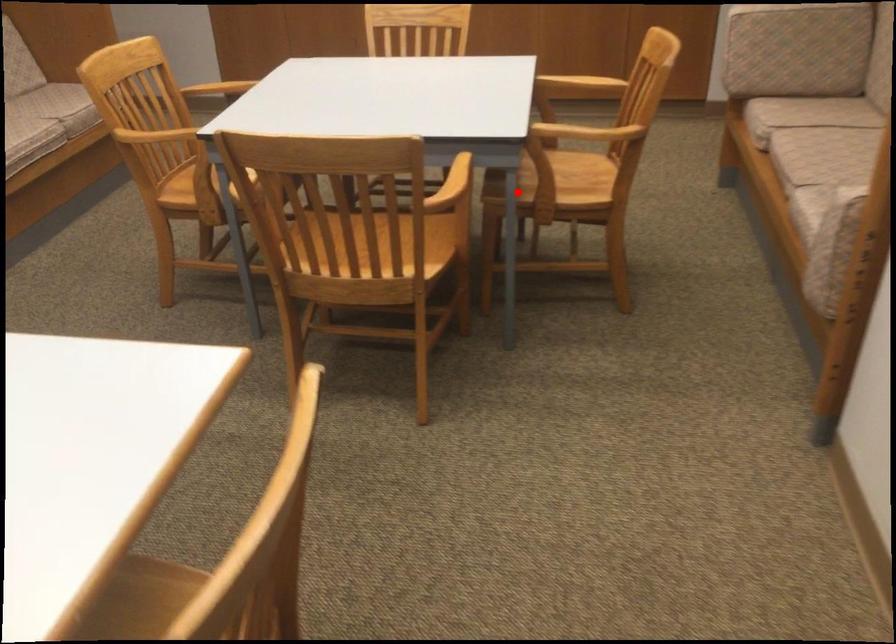
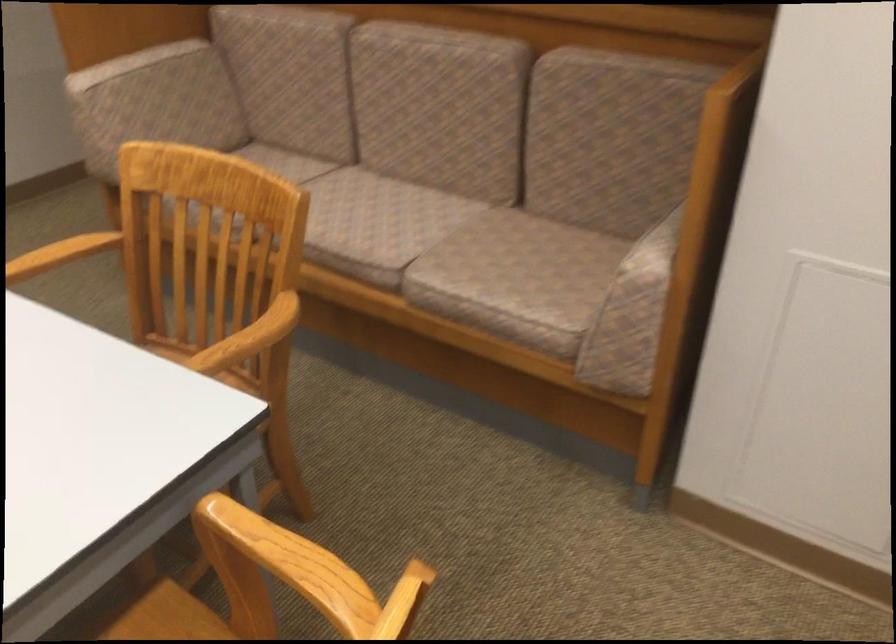
Question: I am providing you with two images of the same scene from different viewpoints. Given a red point in image1, look at the same physical point in image2. Is it:

Choices:
 (A) Closer to the viewpoint
 (B) Farther from the viewpoint

Answer: (A)